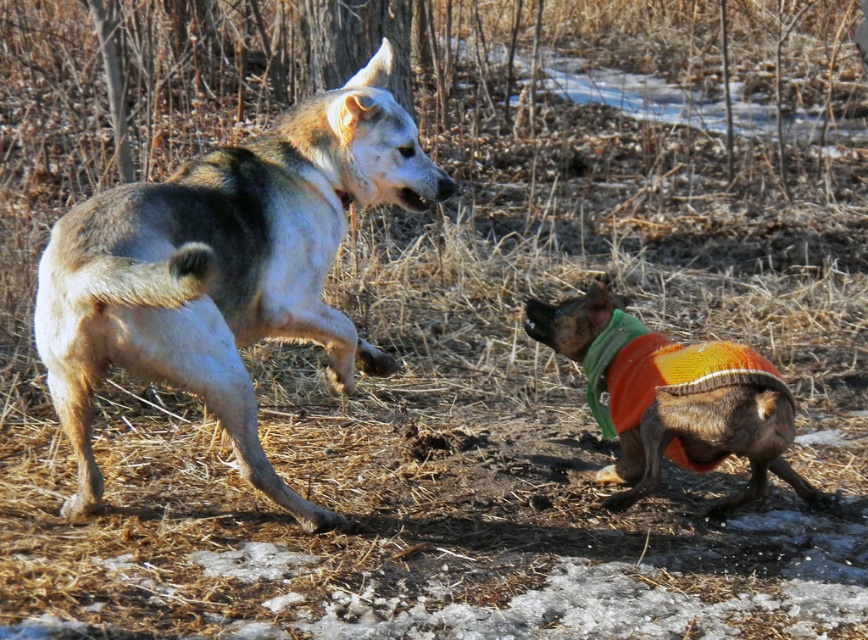
Question: Which object is farther from the camera taking this photo?

Choices:
 (A) gray-furred dog at left
 (B) multicolored knitted sweater at lower right

Answer: (B)

Question: Is gray-furred dog at left wider than multicolored knitted sweater at lower right?

Choices:
 (A) yes
 (B) no

Answer: (A)

Question: Is gray-furred dog at left thinner than multicolored knitted sweater at lower right?

Choices:
 (A) no
 (B) yes

Answer: (A)

Question: Which of the following is the closest to the observer?

Choices:
 (A) multicolored knitted sweater at lower right
 (B) gray-furred dog at left

Answer: (B)

Question: Can you confirm if gray-furred dog at left is positioned below multicolored knitted sweater at lower right?

Choices:
 (A) yes
 (B) no

Answer: (B)